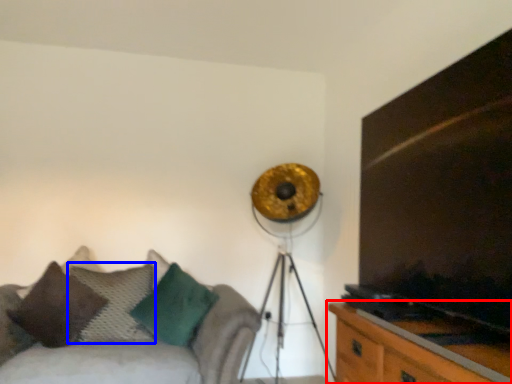
Question: Which of the following is the farthest to the observer, table (highlighted by a red box) or pillow (highlighted by a blue box)?

Choices:
 (A) table
 (B) pillow

Answer: (B)